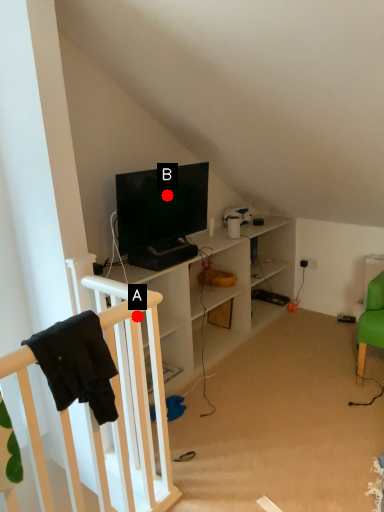
Question: Two points are circled on the image, labeled by A and B beside each circle. Which point is farther to the camera?

Choices:
 (A) A is further
 (B) B is further

Answer: (B)